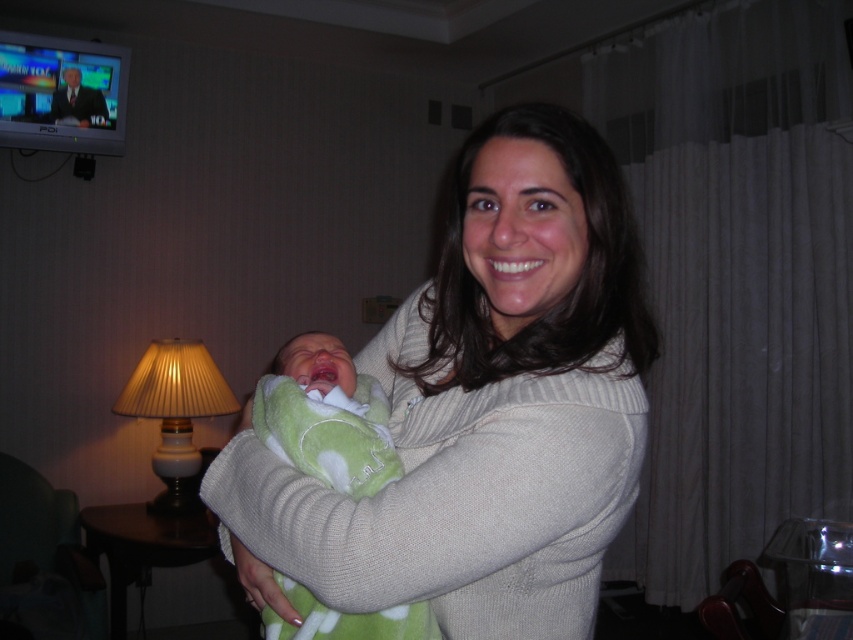
From the picture: Can you confirm if white knit sweater at center is bigger than matte beige lampshade at left?

Yes, white knit sweater at center is bigger than matte beige lampshade at left.

Can you confirm if white knit sweater at center is shorter than matte beige lampshade at left?

Yes.

Locate an element on the screen. This screenshot has width=853, height=640. white knit sweater at center is located at coordinates (483, 406).

I want to click on white knit sweater at center, so click(483, 406).

Who is more distant from viewer, (397, 627) or (183, 442)?

The point (183, 442) is more distant.

Who is higher up, green soft blanket at center or matte beige lampshade at left?

green soft blanket at center is higher up.

Does point (367, 445) come closer to viewer compared to point (171, 387)?

Yes, it is in front of point (171, 387).

Find the location of a particular element. This screenshot has height=640, width=853. green soft blanket at center is located at coordinates (325, 417).

Looking at this image, can you confirm if white knit sweater at center is wider than green soft blanket at center?

Indeed, white knit sweater at center has a greater width compared to green soft blanket at center.

Who is more distant from viewer, (x=599, y=332) or (x=335, y=465)?

Point (x=599, y=332)

Who is more distant from viewer, (358, 596) or (341, 396)?

The point (341, 396) is more distant.

I want to click on white knit sweater at center, so click(x=483, y=406).